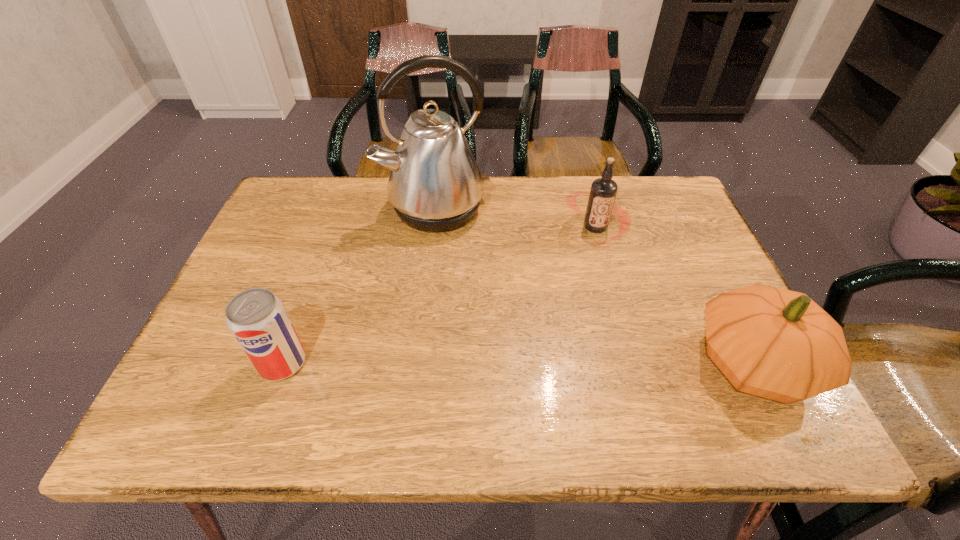
At what (x,y) coordinates should I click in order to perform the action: click on free spot on the desktop that is between the soda and the gourd and is positioned on the label of the root beer. Please return your answer as a coordinate pair (x, y). Looking at the image, I should click on pos(581,363).

The width and height of the screenshot is (960, 540). I want to click on free space on the desktop that is between the leftmost object and the rightmost object and is positioned from the spout of the second object from left to right, so click(x=516, y=363).